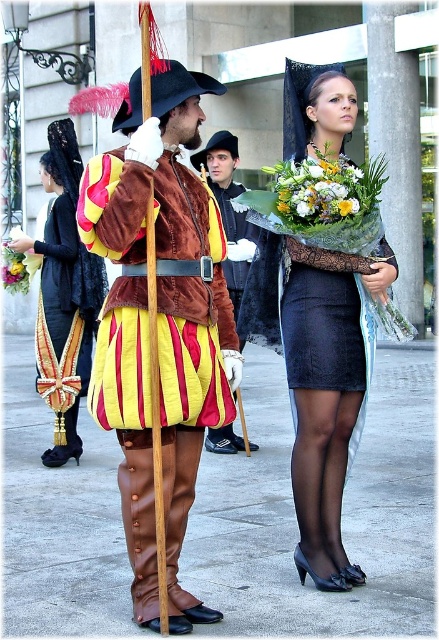
Question: Which point appears farthest from the camera in this image?

Choices:
 (A) (341, 202)
 (B) (27, 285)

Answer: (B)

Question: Which of the following is the farthest from the observer?

Choices:
 (A) floral bouquet at center
 (B) matte black dress at center

Answer: (B)

Question: Can you confirm if velvet brown coat at center is smaller than floral bouquet at center?

Choices:
 (A) no
 (B) yes

Answer: (B)

Question: Is velvet brown coat at center thinner than matte black dress at center?

Choices:
 (A) no
 (B) yes

Answer: (A)

Question: Based on their relative distances, which object is nearer to the white floral bouquet at center?

Choices:
 (A) floral bouquet at center
 (B) matte yellow ribbon at left
 (C) matte black dress at center

Answer: (A)

Question: Does brown leather coat at center have a lesser width compared to floral bouquet at center?

Choices:
 (A) yes
 (B) no

Answer: (B)